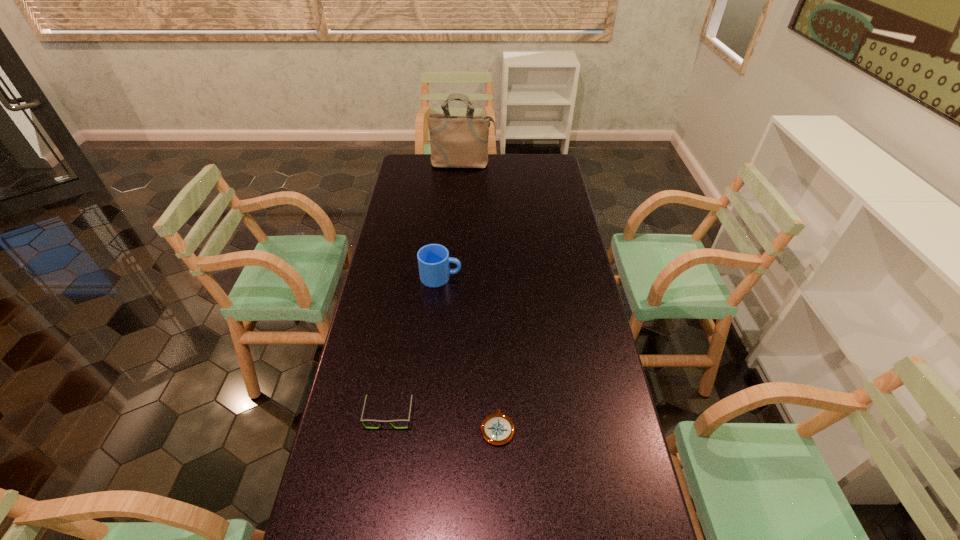
Where is `object that is at the far edge`? This screenshot has height=540, width=960. object that is at the far edge is located at coordinates (456, 142).

You are a GUI agent. You are given a task and a screenshot of the screen. Output one action in this format:
    pyautogui.click(x=<x>, y=<y>)
    Task: Click on the shoulder bag present at the left edge
    The height and width of the screenshot is (540, 960).
    Given the screenshot: What is the action you would take?
    pyautogui.click(x=456, y=142)

This screenshot has height=540, width=960. I want to click on spectacles located at the left edge, so click(x=367, y=420).

Identify the location of object at the far left corner. (456, 142).

Identify the location of free space at the far edge. (468, 170).

Identify the location of free region at the left edge. 360,400.

Where is `free spot at the right edge of the desktop`? The height and width of the screenshot is (540, 960). free spot at the right edge of the desktop is located at coordinates (546, 191).

Image resolution: width=960 pixels, height=540 pixels. In order to click on vacant space that is in between the second shortest object and the compass in this screenshot , I will do `click(444, 421)`.

Find the location of a particular element. The image size is (960, 540). free space that is in between the farthest object and the spectacles is located at coordinates (426, 290).

Where is `unoccupied area between the tallest object and the spectacles`? Image resolution: width=960 pixels, height=540 pixels. unoccupied area between the tallest object and the spectacles is located at coordinates (x=426, y=290).